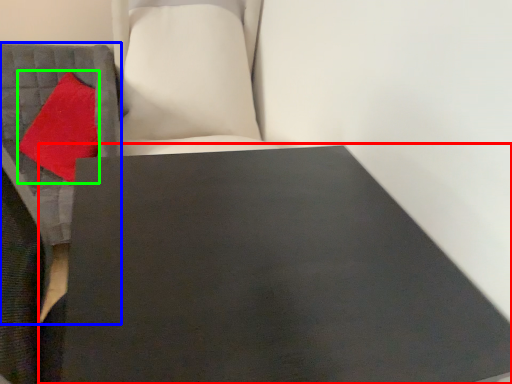
Question: Which object is positioned closest to table (highlighted by a red box)? Select from furniture (highlighted by a blue box) and throw pillow (highlighted by a green box).

Choices:
 (A) furniture
 (B) throw pillow

Answer: (A)